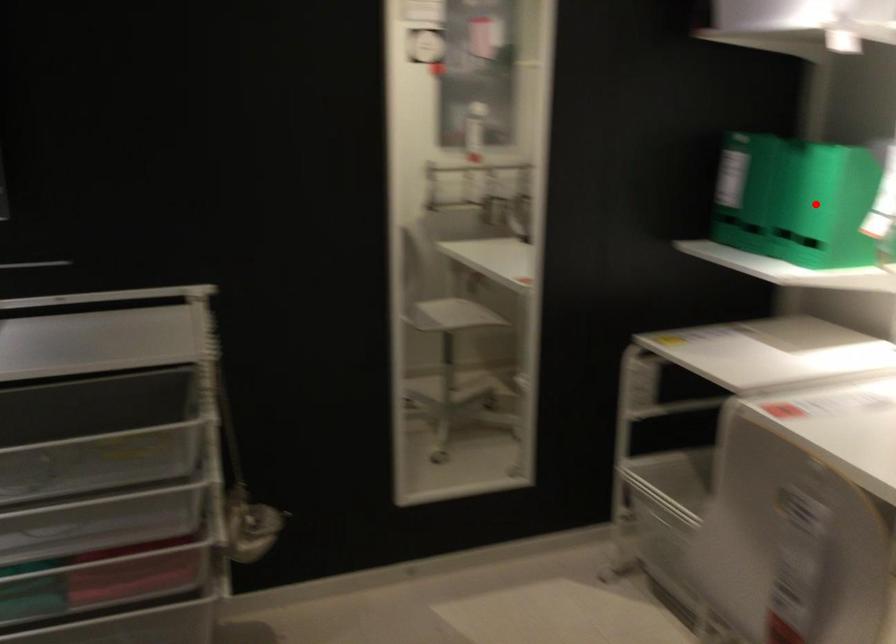
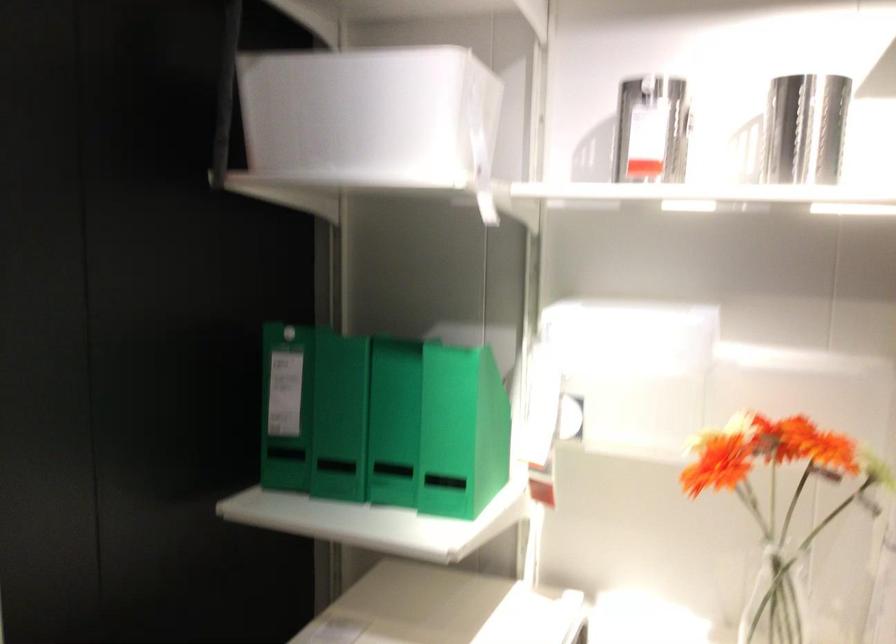
Locate, in the second image, the point that corresponds to the highlighted location in the first image.

(461, 431)